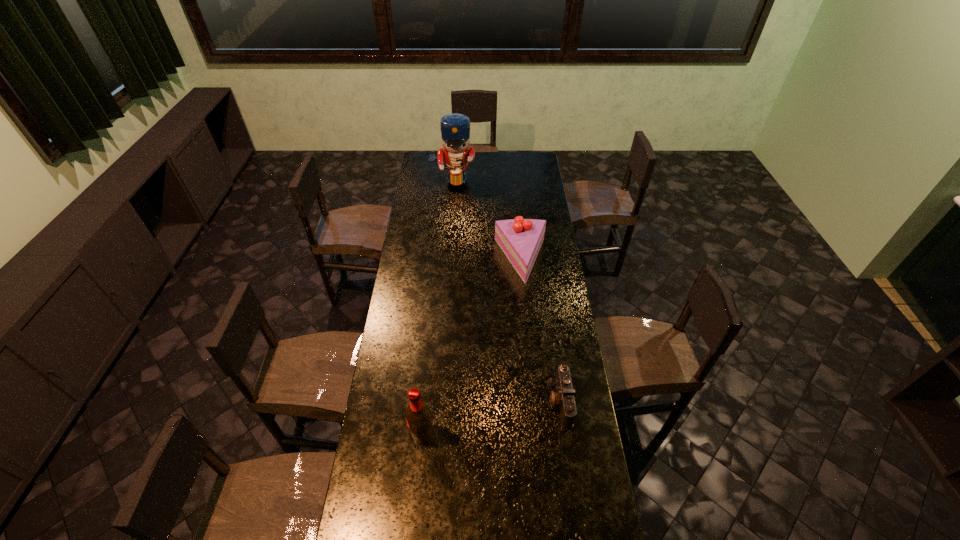
Image resolution: width=960 pixels, height=540 pixels. Find the location of `object that is the nearest to the beer bottle`. object that is the nearest to the beer bottle is located at coordinates [x=564, y=398].

The image size is (960, 540). I want to click on object identified as the third closest to the camera, so click(455, 128).

Image resolution: width=960 pixels, height=540 pixels. I want to click on vacant space that satisfies the following two spatial constraints: 1. on the back side of the second shortest object; 2. on the right side of the beer bottle, so click(439, 260).